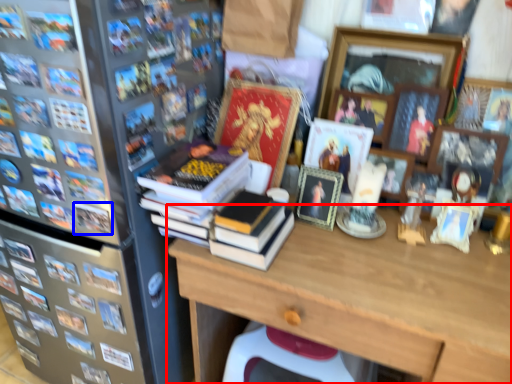
Question: Which point is further to the camera, desk (highlighted by a red box) or book (highlighted by a blue box)?

Choices:
 (A) desk
 (B) book

Answer: (B)